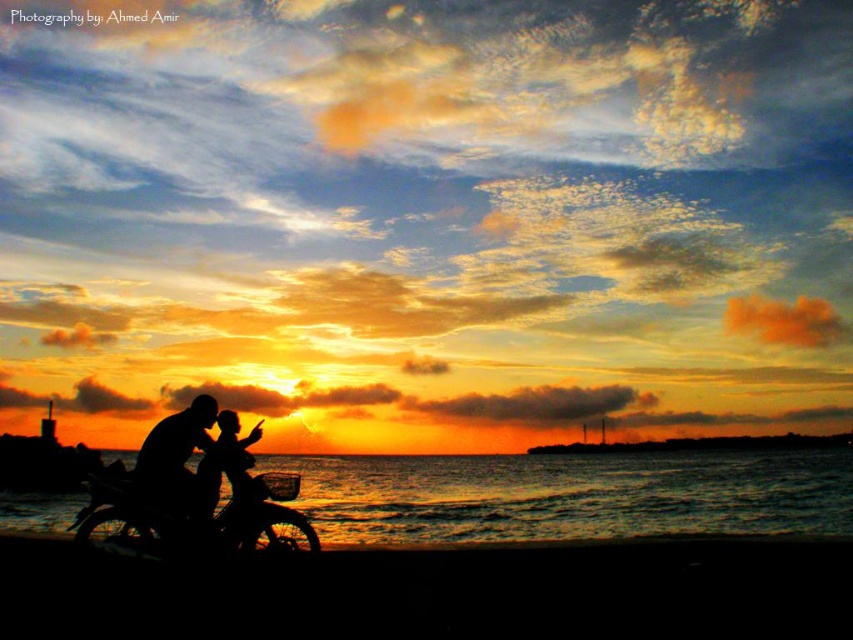
Who is positioned more to the right, black water at lower center or black matte motorcycle at lower left?

black matte motorcycle at lower left is more to the right.

The width and height of the screenshot is (853, 640). In order to click on black water at lower center in this screenshot , I will do `click(570, 493)`.

I want to click on black water at lower center, so click(570, 493).

Based on the photo, does black matte motorcycle at lower left appear on the left side of silhouette human at center?

Incorrect, black matte motorcycle at lower left is not on the left side of silhouette human at center.

Measure the distance between point (119, 524) and camera.

Point (119, 524) and camera are 12.77 meters apart from each other.

Locate an element on the screen. Image resolution: width=853 pixels, height=640 pixels. black matte motorcycle at lower left is located at coordinates (192, 520).

Is black water at lower center to the right of silhouette human at center from the viewer's perspective?

In fact, black water at lower center is to the left of silhouette human at center.

Is point (407, 502) farther from camera compared to point (178, 420)?

That is True.

Find the location of a particular element. black water at lower center is located at coordinates (570, 493).